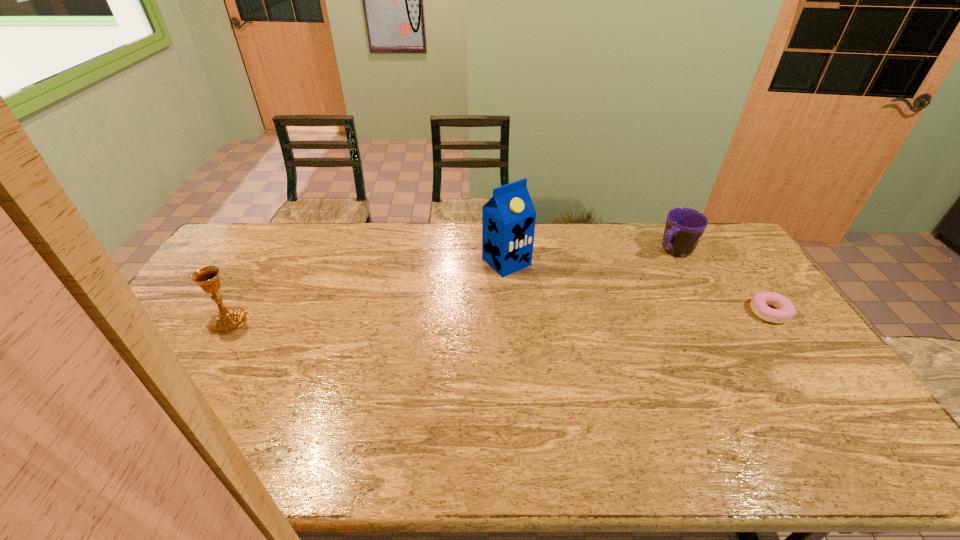
Find the location of a particular element. This screenshot has height=540, width=960. free space that satisfies the following two spatial constraints: 1. on the back side of the second tallest object; 2. on the left side of the mug is located at coordinates point(270,251).

What are the coordinates of `vacant space that satisfies the following two spatial constraints: 1. on the back side of the third shortest object; 2. on the left side of the rightmost object` in the screenshot? It's located at (233, 312).